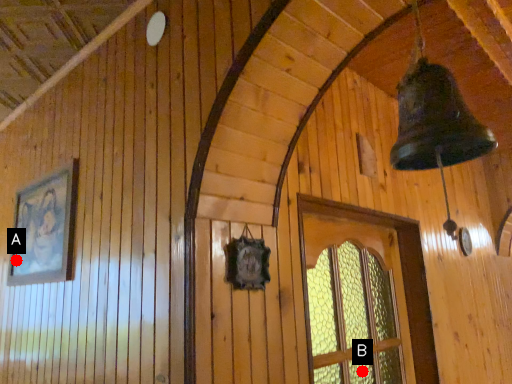
Question: Two points are circled on the image, labeled by A and B beside each circle. Which point is closer to the camera?

Choices:
 (A) A is closer
 (B) B is closer

Answer: (B)